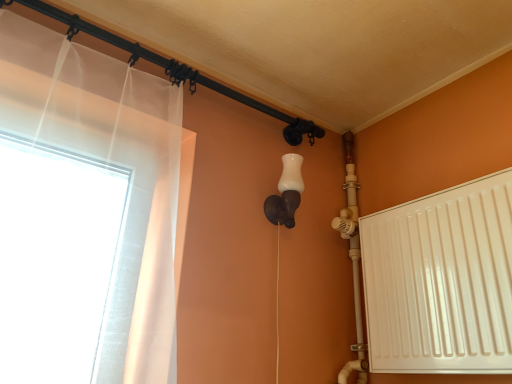
Question: Are black metal pipe at upper left and white matte wall sconce at center located far from each other?

Choices:
 (A) no
 (B) yes

Answer: (A)

Question: Would you say black metal pipe at upper left is outside white matte wall sconce at center?

Choices:
 (A) no
 (B) yes

Answer: (B)

Question: Is black metal pipe at upper left further to the viewer compared to white matte wall sconce at center?

Choices:
 (A) yes
 (B) no

Answer: (B)

Question: Does black metal pipe at upper left appear on the left side of white matte wall sconce at center?

Choices:
 (A) no
 (B) yes

Answer: (B)

Question: Does black metal pipe at upper left have a smaller size compared to white matte wall sconce at center?

Choices:
 (A) no
 (B) yes

Answer: (B)

Question: Is black metal pipe at upper left oriented towards white matte wall sconce at center?

Choices:
 (A) no
 (B) yes

Answer: (A)

Question: From a real-world perspective, is white matte radiator at right on black metal pipe at upper left?

Choices:
 (A) yes
 (B) no

Answer: (B)

Question: Can you confirm if white matte radiator at right is positioned to the right of black metal pipe at upper left?

Choices:
 (A) no
 (B) yes

Answer: (B)

Question: Is white matte radiator at right shorter than black metal pipe at upper left?

Choices:
 (A) yes
 (B) no

Answer: (B)

Question: Would you say white matte radiator at right is a long distance from black metal pipe at upper left?

Choices:
 (A) yes
 (B) no

Answer: (B)

Question: Is white matte radiator at right positioned behind black metal pipe at upper left?

Choices:
 (A) no
 (B) yes

Answer: (A)

Question: From a real-world perspective, is white matte radiator at right positioned under black metal pipe at upper left based on gravity?

Choices:
 (A) no
 (B) yes

Answer: (B)

Question: From the image's perspective, is black metal pipe at upper left on white matte radiator at right?

Choices:
 (A) no
 (B) yes

Answer: (B)